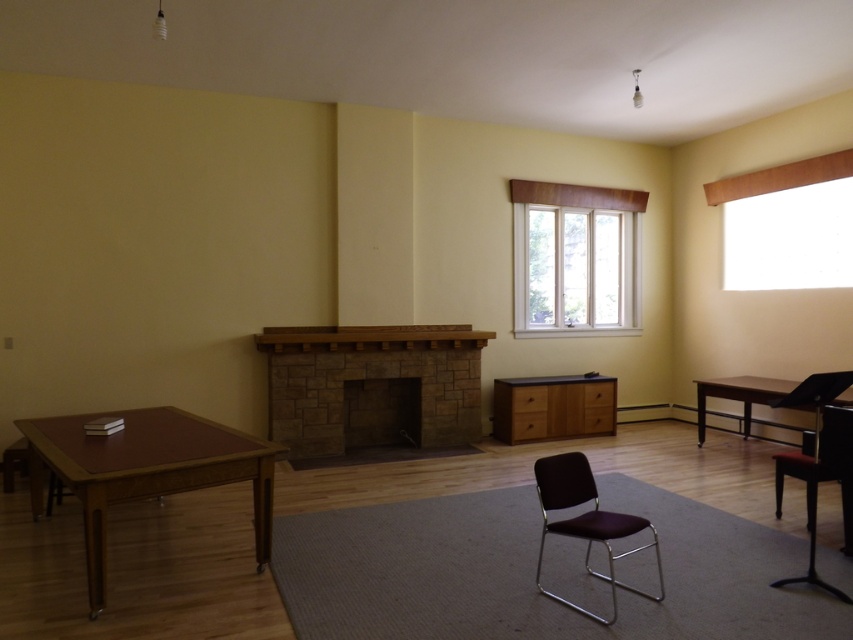
Question: Does brown stone fireplace at center appear on the left side of brown wood table at left?

Choices:
 (A) yes
 (B) no

Answer: (B)

Question: Is brown wood table at left bigger than purple vinyl swivel chair at center?

Choices:
 (A) no
 (B) yes

Answer: (B)

Question: Among these objects, which one is nearest to the camera?

Choices:
 (A) purple vinyl swivel chair at center
 (B) brown stone fireplace at center
 (C) brown wood table at left

Answer: (C)

Question: Which object appears closest to the camera in this image?

Choices:
 (A) white wood window at center
 (B) brown wood table at left

Answer: (B)

Question: Does brown stone fireplace at center appear under brown wood table at left?

Choices:
 (A) yes
 (B) no

Answer: (B)

Question: Which of the following is the farthest from the observer?

Choices:
 (A) white wood window at center
 (B) brown wood table at left

Answer: (A)